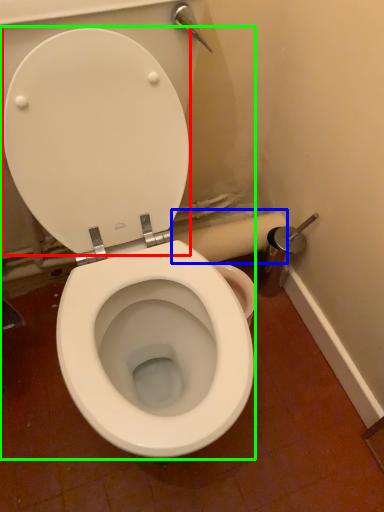
Question: Estimate the real-world distances between objects in this image. Which object is closer to back (highlighted by a red box), toilet paper (highlighted by a blue box) or toilet (highlighted by a green box)?

Choices:
 (A) toilet paper
 (B) toilet

Answer: (B)